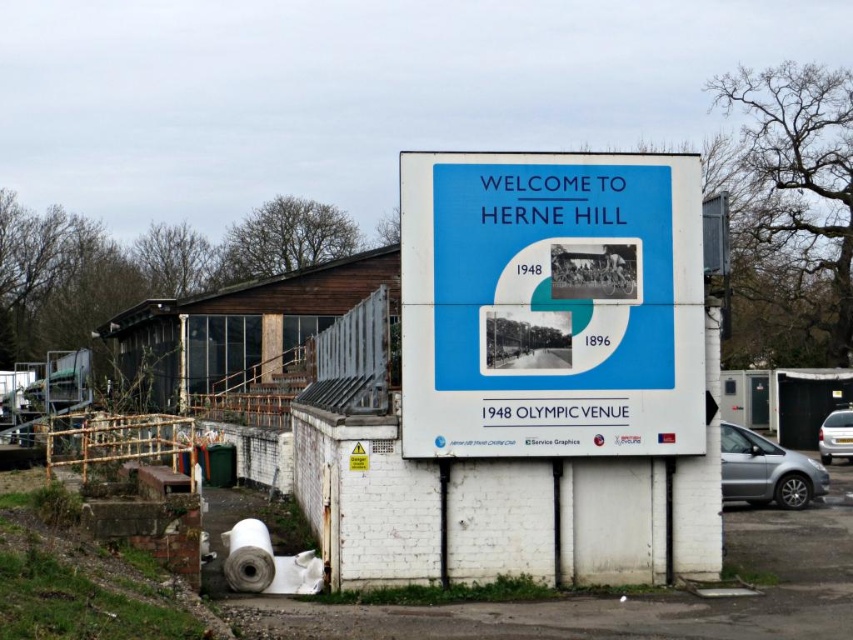
You are standing in front of the billboard and want to take a photo that includes both the silver metallic car at lower right and the silver metallic car at right. Which car is closer to you so that you can frame them both in the shot?

The silver metallic car at lower right is closer to you, so you can frame both cars in the shot by positioning yourself to include the closer car and the one further away.

You are a photographer trying to capture both the blue matte signboard at center and the silver metallic car at right in a single frame. Based on their sizes, which object should you position closer to the camera to ensure both fit in the frame?

The blue matte signboard at center is wider than the silver metallic car at right. To fit both in the frame, position the silver metallic car at right closer to the camera since it is narrower and requires less space, allowing the wider blue matte signboard at center to be farther back but still visible.